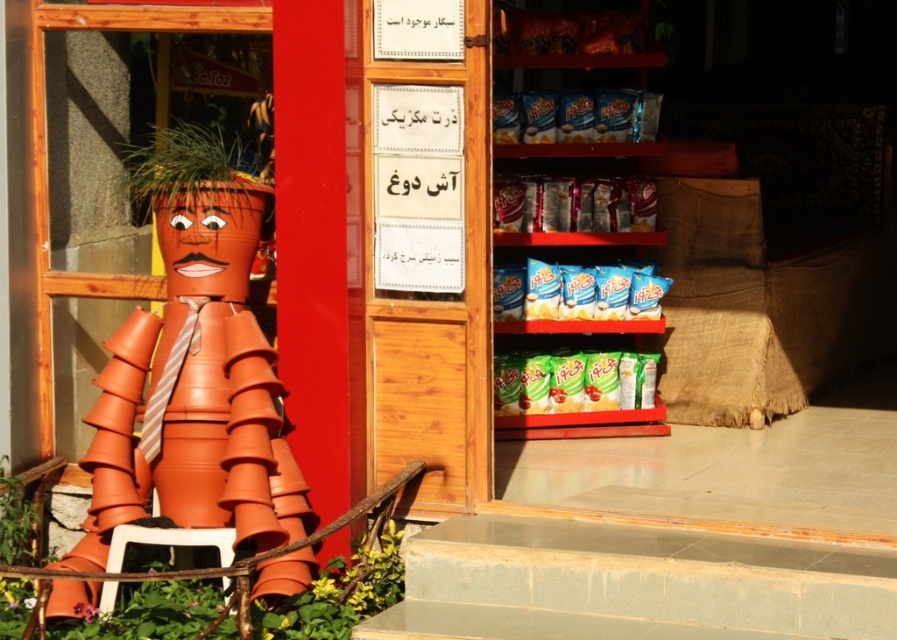
Who is taller, shiny metallic chips at upper right or blue glossy chips at upper right?

With more height is blue glossy chips at upper right.

Which is above, shiny metallic chips at upper right or blue glossy chips at upper right?

shiny metallic chips at upper right is higher up.

At what (x,y) coordinates should I click in order to perform the action: click on shiny metallic chips at upper right. Please return your answer as a coordinate pair (x, y). The width and height of the screenshot is (897, 640). Looking at the image, I should click on (573, 204).

Is point (588, 378) closer to camera compared to point (530, 124)?

No, (588, 378) is behind (530, 124).

Is green matte snack packet at center above blue glossy chips at upper center?

No, green matte snack packet at center is not above blue glossy chips at upper center.

Is point (647, 376) less distant than point (643, 102)?

That is False.

At what (x,y) coordinates should I click in order to perform the action: click on green matte snack packet at center. Please return your answer as a coordinate pair (x, y). The height and width of the screenshot is (640, 897). Looking at the image, I should click on (573, 381).

Can you confirm if green matte snack packet at center is smaller than blue glossy chips at upper right?

Incorrect, green matte snack packet at center is not smaller in size than blue glossy chips at upper right.

Is point (506, 374) farther from viewer compared to point (523, 314)?

No, it is in front of (523, 314).

Find the location of a particular element. Image resolution: width=897 pixels, height=640 pixels. green matte snack packet at center is located at coordinates (573, 381).